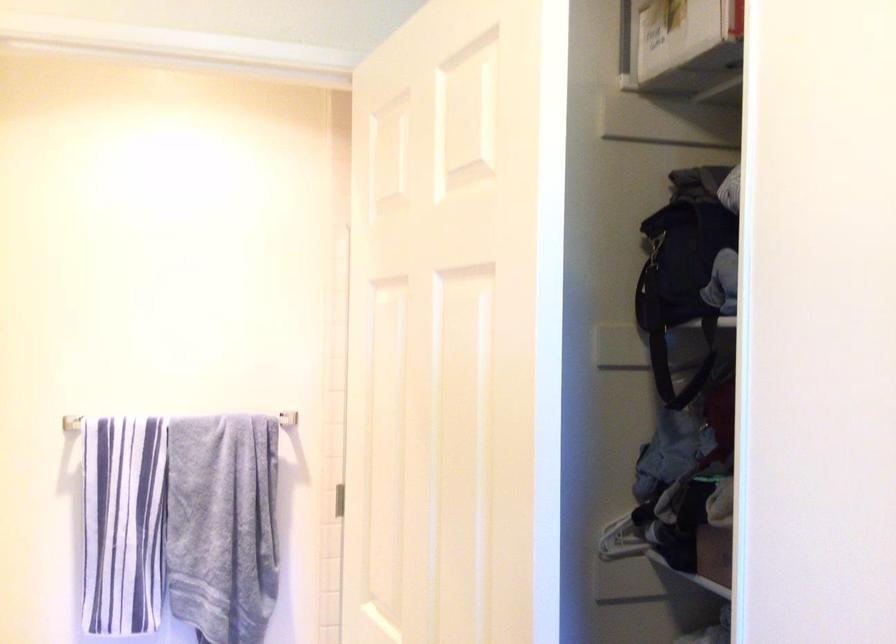
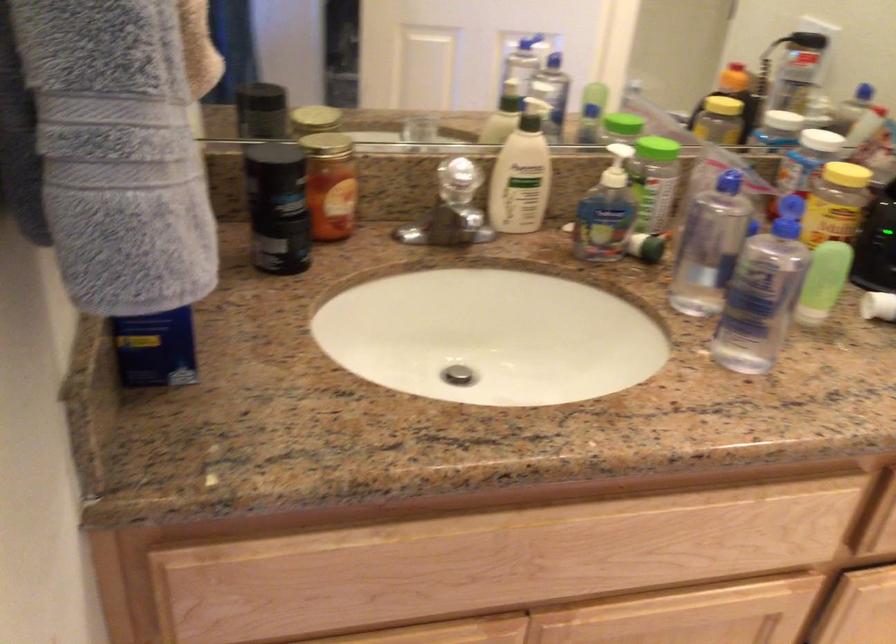
Based on the continuous images, in which direction is the camera rotating?

The rotation direction of the camera is left-down.